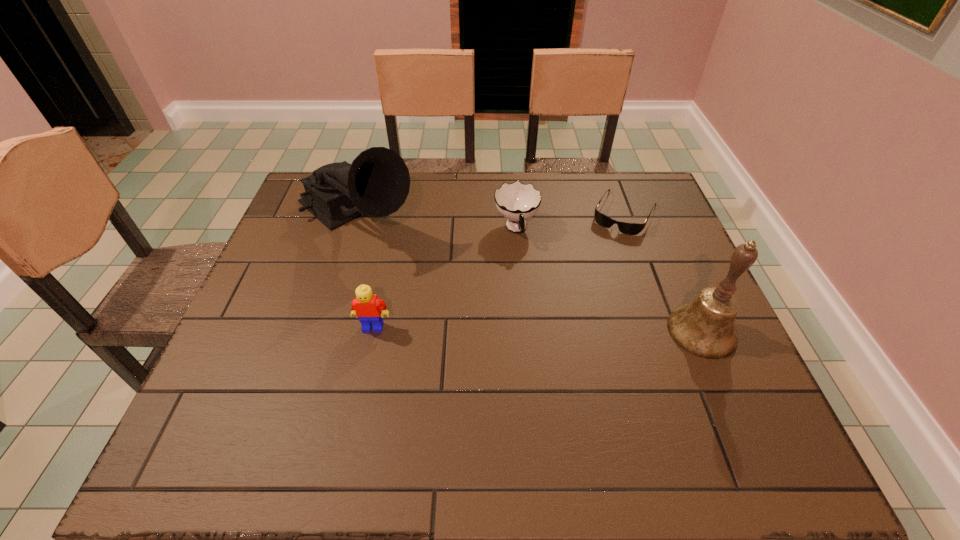
You are a GUI agent. You are given a task and a screenshot of the screen. Output one action in this format:
    pyautogui.click(x=<x>, y=<y>)
    Task: Click on the third shortest object
    
    Given the screenshot: What is the action you would take?
    pyautogui.click(x=367, y=307)

Locate an element on the screen. bell is located at coordinates (705, 327).

Image resolution: width=960 pixels, height=540 pixels. I want to click on the third object from left to right, so pos(517,202).

The width and height of the screenshot is (960, 540). I want to click on the second shortest object, so click(x=517, y=202).

Locate an element on the screen. This screenshot has height=540, width=960. phonograph_record is located at coordinates (377, 183).

This screenshot has height=540, width=960. Find the location of `sunglasses`. sunglasses is located at coordinates (627, 228).

Where is `free space located 0.060m on the front-facing side of the Lego`? free space located 0.060m on the front-facing side of the Lego is located at coordinates (368, 355).

You are a GUI agent. You are given a task and a screenshot of the screen. Output one action in this format:
    pyautogui.click(x=<x>, y=<y>)
    Task: Click on the free location located on the back of the bell
    
    Given the screenshot: What is the action you would take?
    point(684,290)

I want to click on vacant area situated on the side of the third object from right to left with the handle, so click(529, 282).

Identify the location of vacant region located 0.100m on the side of the third object from right to left with the handle. This screenshot has height=540, width=960. (527, 274).